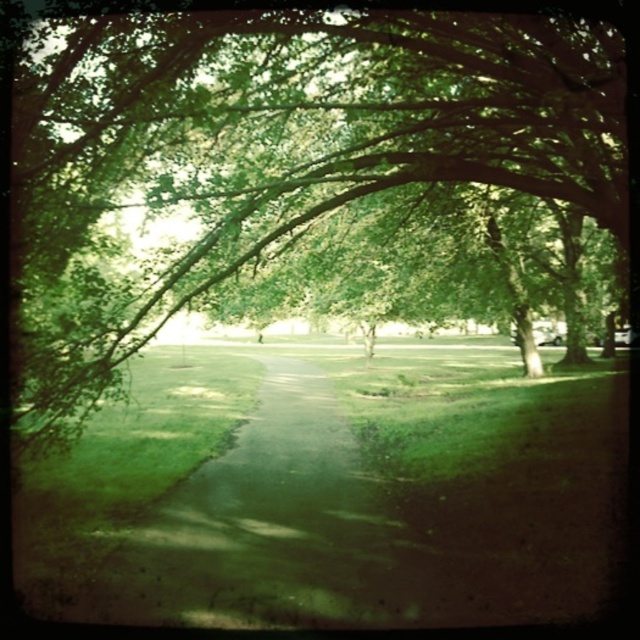
You are standing on the green grassy path at center in the park. You want to walk straight ahead but notice the green leafy tree at center above you. Will the tree block your path?

The green leafy tree at center is positioned over the green grassy path at center, so the tree will block your path as you walk straight ahead.

You are standing in the park and want to take a photo of the green leafy tree at center. If your camera has a maximum focus range of 7 meters, will it be able to capture the tree clearly?

The green leafy tree at center is 7.34 meters away from the viewer. Since the camera can only focus up to 7 meters, it will not be able to capture the tree clearly.

You are a gardener planning to plant flowers along the edges of the green grassy path at center. Considering the width of the green leafy tree at center, will you have enough space to plant the flowers without encroaching on the tree?

The green leafy tree at center is narrower than the green grassy path at center, so there should be sufficient space to plant flowers along the path edges without encroaching on the tree.